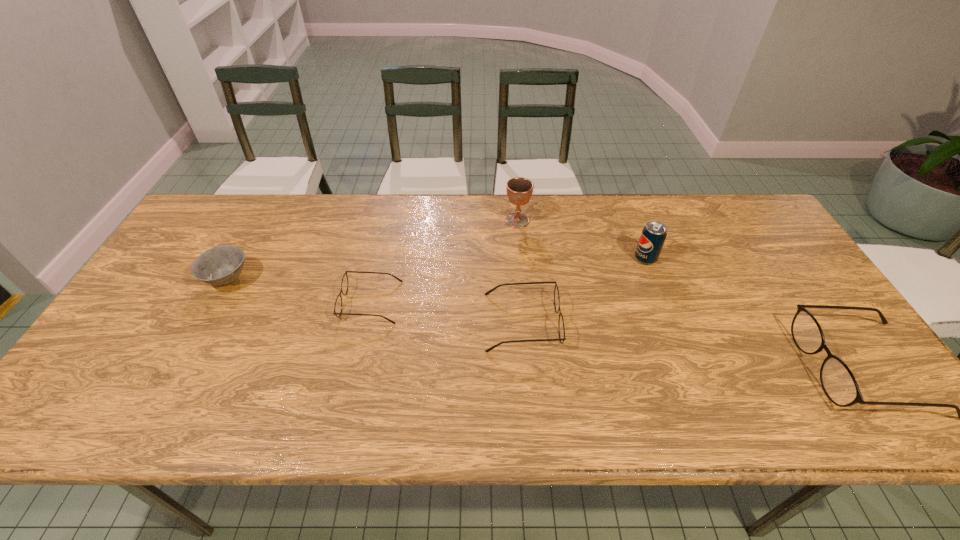
If equal spacing is the goal by inserting an additional spectacles among them, please point out a vacant space for this new spectacles. Please provide its 2D coordinates. Your answer should be formatted as a tuple, i.e. [(x, y)], where the tuple contains the x and y coordinates of a point satisfying the conditions above.

[(685, 344)]